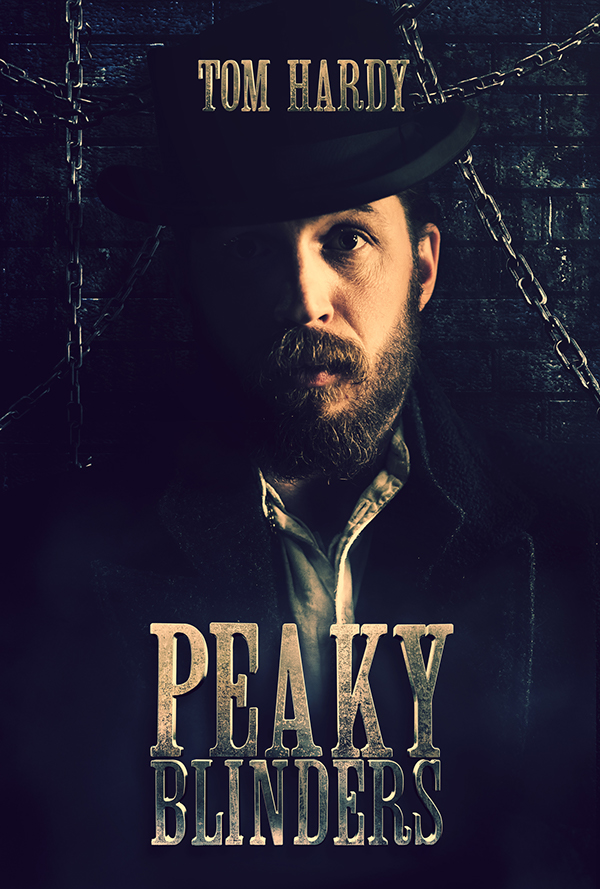
Locate an element on the screen. Image resolution: width=600 pixels, height=889 pixels. blinders is located at coordinates (265, 812).